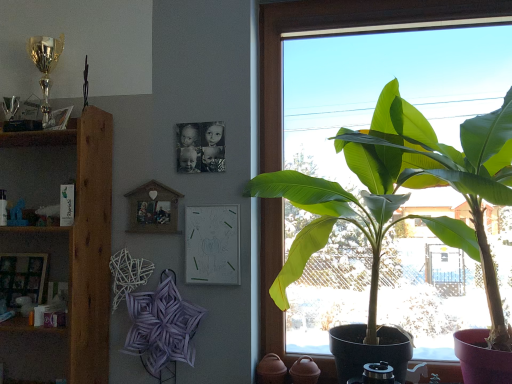
Describe the element at coordinates (438, 176) in the screenshot. I see `green leafy plant at right` at that location.

Measure the distance between wooden shelf at left and camera.

A distance of 5.67 feet exists between wooden shelf at left and camera.

What do you see at coordinates (212, 244) in the screenshot? This screenshot has width=512, height=384. I see `white paper at center, the 1th picture frame viewed from the right` at bounding box center [212, 244].

What do you see at coordinates (345, 34) in the screenshot?
I see `transparent glass window at right` at bounding box center [345, 34].

Where is `green leafy plant at right`? The image size is (512, 384). green leafy plant at right is located at coordinates (438, 176).

Based on their sizes in the image, would you say white paper at center, which is the 3th picture frame in left-to-right order, is bigger or smaller than wooden picture frame at lower left, acting as the first picture frame starting from the left?

In the image, white paper at center, which is the 3th picture frame in left-to-right order, appears to be smaller than wooden picture frame at lower left, acting as the first picture frame starting from the left.

Is the depth of white paper at center, the 1th picture frame viewed from the right, greater than that of wooden picture frame at lower left, acting as the first picture frame starting from the left?

No, the depth of white paper at center, the 1th picture frame viewed from the right, is less than that of wooden picture frame at lower left, acting as the first picture frame starting from the left.

How many degrees apart are the facing directions of white paper at center, the 1th picture frame viewed from the right, and wooden picture frame at lower left, the 3th picture frame from the right?

The angle between the facing direction of white paper at center, the 1th picture frame viewed from the right, and the facing direction of wooden picture frame at lower left, the 3th picture frame from the right, is 0.589 degrees.

Is white paper at center, the 1th picture frame viewed from the right, taller or shorter than wooden picture frame at lower left, the 3th picture frame from the right?

Considering their sizes, white paper at center, the 1th picture frame viewed from the right, has more height than wooden picture frame at lower left, the 3th picture frame from the right.

Between white paper at center, the 1th picture frame viewed from the right, and transparent glass window at right, which one has less height?

white paper at center, the 1th picture frame viewed from the right.

How many degrees apart are the facing directions of white paper at center, which is the 3th picture frame in left-to-right order, and transparent glass window at right?

The angular difference between white paper at center, which is the 3th picture frame in left-to-right order, and transparent glass window at right is 0.864 degrees.

Can you confirm if white paper at center, which is the 3th picture frame in left-to-right order, is bigger than transparent glass window at right?

No.

From the picture: Which point is more forward, (x=197, y=279) or (x=280, y=25)?

The point (x=197, y=279) is closer to the camera.

Could wooden shelf at left be considered to be inside wooden picture frame at lower left, the 3th picture frame from the right?

No, wooden shelf at left is not surrounded by wooden picture frame at lower left, the 3th picture frame from the right.

Who is bigger, wooden picture frame at lower left, acting as the first picture frame starting from the left, or wooden shelf at left?

With larger size is wooden shelf at left.

Does wooden picture frame at lower left, acting as the first picture frame starting from the left, turn towards wooden shelf at left?

No, wooden picture frame at lower left, acting as the first picture frame starting from the left, does not turn towards wooden shelf at left.

How much distance is there between wooden picture frame at lower left, the 3th picture frame from the right, and wooden shelf at left?

A distance of 13.09 inches exists between wooden picture frame at lower left, the 3th picture frame from the right, and wooden shelf at left.

Which is more to the left, wooden shelf at left or wooden photo frame at upper center, positioned as the second picture frame in right-to-left order?

Positioned to the left is wooden shelf at left.

This screenshot has height=384, width=512. Identify the location of cabinet lying in front of the wooden photo frame at upper center, positioned as the second picture frame in left-to-right order. (37, 173).

Does point (48, 198) lie in front of point (174, 204)?

No, (48, 198) is behind (174, 204).

Is wooden shelf at left oriented towards wooden photo frame at upper center, positioned as the second picture frame in right-to-left order?

No.

Considering the sizes of objects wooden photo frame at upper center, positioned as the second picture frame in right-to-left order, and wooden picture frame at lower left, acting as the first picture frame starting from the left, in the image provided, who is smaller, wooden photo frame at upper center, positioned as the second picture frame in right-to-left order, or wooden picture frame at lower left, acting as the first picture frame starting from the left,?

wooden photo frame at upper center, positioned as the second picture frame in right-to-left order.

Does wooden photo frame at upper center, positioned as the second picture frame in left-to-right order, have a greater height compared to wooden picture frame at lower left, acting as the first picture frame starting from the left?

In fact, wooden photo frame at upper center, positioned as the second picture frame in left-to-right order, may be shorter than wooden picture frame at lower left, acting as the first picture frame starting from the left.

Which is farther from the camera, (x=135, y=193) or (x=30, y=270)?

Positioned behind is point (x=30, y=270).

Is wooden photo frame at upper center, positioned as the second picture frame in left-to-right order, located outside wooden picture frame at lower left, the 3th picture frame from the right?

Yes, wooden photo frame at upper center, positioned as the second picture frame in left-to-right order, is located beyond the bounds of wooden picture frame at lower left, the 3th picture frame from the right.

Choose the correct answer: Is wooden photo frame at upper center, positioned as the second picture frame in right-to-left order, inside wooden shelf at left or outside it?

wooden photo frame at upper center, positioned as the second picture frame in right-to-left order, is spatially situated outside wooden shelf at left.

Is point (155, 199) less distant than point (35, 241)?

Yes, point (155, 199) is in front of point (35, 241).

Is wooden photo frame at upper center, positioned as the second picture frame in right-to-left order, facing towards wooden shelf at left?

No, wooden photo frame at upper center, positioned as the second picture frame in right-to-left order, does not turn towards wooden shelf at left.

Considering the sizes of objects wooden photo frame at upper center, positioned as the second picture frame in right-to-left order, and wooden shelf at left in the image provided, who is smaller, wooden photo frame at upper center, positioned as the second picture frame in right-to-left order, or wooden shelf at left?

wooden photo frame at upper center, positioned as the second picture frame in right-to-left order, is smaller.

Where is `the 3rd picture frame behind the wooden shelf at left, starting your count from the anchor`? Image resolution: width=512 pixels, height=384 pixels. the 3rd picture frame behind the wooden shelf at left, starting your count from the anchor is located at coordinates (23, 277).

Can wooden shelf at left be found inside wooden picture frame at lower left, acting as the first picture frame starting from the left?

No, wooden picture frame at lower left, acting as the first picture frame starting from the left, does not contain wooden shelf at left.

From their relative heights in the image, would you say wooden picture frame at lower left, acting as the first picture frame starting from the left, is taller or shorter than wooden shelf at left?

Clearly, wooden picture frame at lower left, acting as the first picture frame starting from the left, is shorter compared to wooden shelf at left.

Starting from the wooden picture frame at lower left, acting as the first picture frame starting from the left, which picture frame is the 2nd one to the right? Please provide its 2D coordinates.

[(212, 244)]

Locate an element on the screen. the 2nd picture frame located beneath the transparent glass window at right (from a real-world perspective) is located at coordinates [212, 244].

From the picture: Considering their positions, is green leafy plant at right positioned closer to wooden photo frame at upper center, positioned as the second picture frame in left-to-right order, than wooden shelf at left?

wooden shelf at left is closer to wooden photo frame at upper center, positioned as the second picture frame in left-to-right order.

Based on their spatial positions, is transparent glass window at right or wooden shelf at left closer to wooden shelf at left?

wooden shelf at left is positioned closer to the anchor wooden shelf at left.

Based on the photo, when comparing their distances from wooden picture frame at lower left, the 3th picture frame from the right, does wooden shelf at left or wooden photo frame at upper center, positioned as the second picture frame in left-to-right order, seem closer?

Based on the image, wooden shelf at left appears to be nearer to wooden picture frame at lower left, the 3th picture frame from the right.

Based on their spatial positions, is wooden photo frame at upper center, positioned as the second picture frame in left-to-right order, or wooden shelf at left closer to white paper at center, the 1th picture frame viewed from the right?

Based on the image, wooden photo frame at upper center, positioned as the second picture frame in left-to-right order, appears to be nearer to white paper at center, the 1th picture frame viewed from the right.

Considering their positions, is wooden picture frame at lower left, acting as the first picture frame starting from the left, positioned further to transparent glass window at right than wooden shelf at left?

wooden picture frame at lower left, acting as the first picture frame starting from the left, lies further to transparent glass window at right than the other object.

Looking at this image, looking at the image, which one is located closer to wooden shelf at left, wooden picture frame at lower left, the 3th picture frame from the right, or transparent glass window at right?

The object closer to wooden shelf at left is wooden picture frame at lower left, the 3th picture frame from the right.

Looking at the image, which one is located further to wooden photo frame at upper center, positioned as the second picture frame in left-to-right order, wooden shelf at left or transparent glass window at right?

transparent glass window at right is positioned further to the anchor wooden photo frame at upper center, positioned as the second picture frame in left-to-right order.

From the image, which object appears to be nearer to white paper at center, which is the 3th picture frame in left-to-right order, wooden shelf at left or green leafy plant at right?

green leafy plant at right is positioned closer to the anchor white paper at center, which is the 3th picture frame in left-to-right order.

Locate an element on the screen. Image resolution: width=512 pixels, height=384 pixels. shelf situated between wooden picture frame at lower left, the 3th picture frame from the right, and white paper at center, the 1th picture frame viewed from the right, from left to right is located at coordinates [x=65, y=242].

I want to click on shelf situated between wooden picture frame at lower left, the 3th picture frame from the right, and green leafy plant at right from left to right, so click(65, 242).

What are the coordinates of `picture frame situated between wooden shelf at left and white paper at center, which is the 3th picture frame in left-to-right order, from left to right` in the screenshot? It's located at (153, 209).

Locate an element on the screen. This screenshot has width=512, height=384. cabinet between wooden shelf at left and wooden photo frame at upper center, positioned as the second picture frame in right-to-left order is located at coordinates (37, 173).